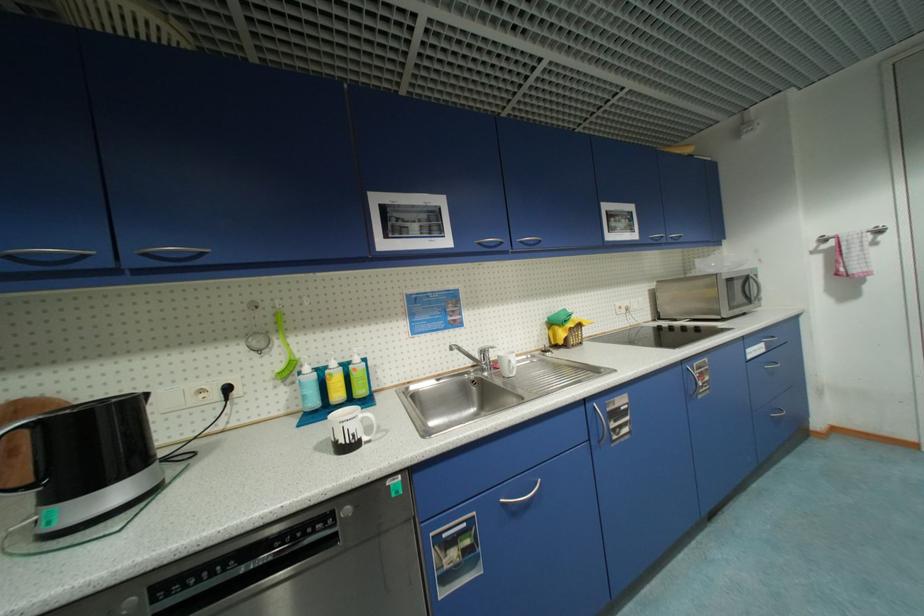
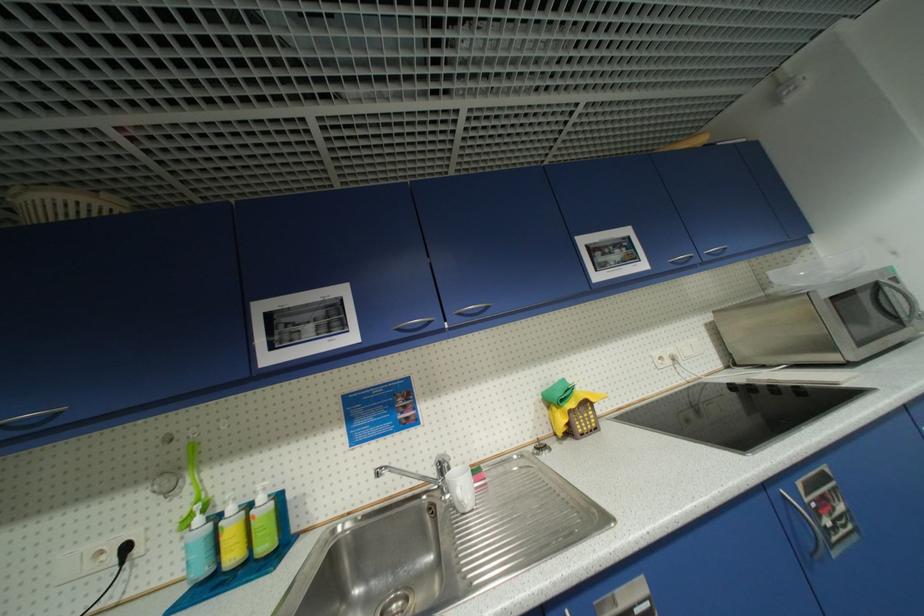
The point at (492,375) is marked in the first image. Where is the corresponding point in the second image?

(454, 496)